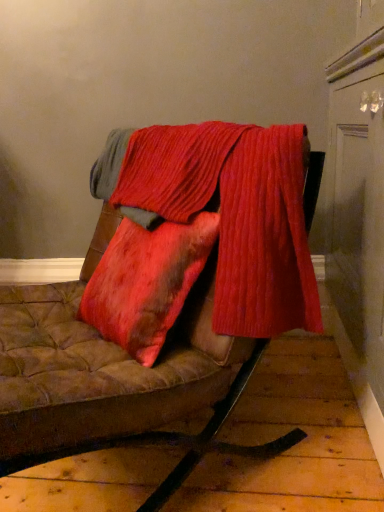
Question: From a real-world perspective, is velvet-like brown cushion at center positioned above or below ribbed red fabric at center?

Choices:
 (A) above
 (B) below

Answer: (B)

Question: From the image's perspective, is velvet-like brown cushion at center located above or below ribbed red fabric at center?

Choices:
 (A) below
 (B) above

Answer: (A)

Question: Considering the positions of point (319, 164) and point (134, 179), is point (319, 164) closer or farther from the camera than point (134, 179)?

Choices:
 (A) closer
 (B) farther

Answer: (A)

Question: Considering the positions of ribbed red fabric at center and velvet-like brown cushion at center in the image, is ribbed red fabric at center bigger or smaller than velvet-like brown cushion at center?

Choices:
 (A) big
 (B) small

Answer: (B)

Question: Considering the positions of point (251, 228) and point (223, 414), is point (251, 228) closer or farther from the camera than point (223, 414)?

Choices:
 (A) farther
 (B) closer

Answer: (B)

Question: Would you say ribbed red fabric at center is inside or outside velvet-like brown cushion at center?

Choices:
 (A) outside
 (B) inside

Answer: (B)

Question: Visually, is ribbed red fabric at center positioned to the left or to the right of velvet-like brown cushion at center?

Choices:
 (A) right
 (B) left

Answer: (A)